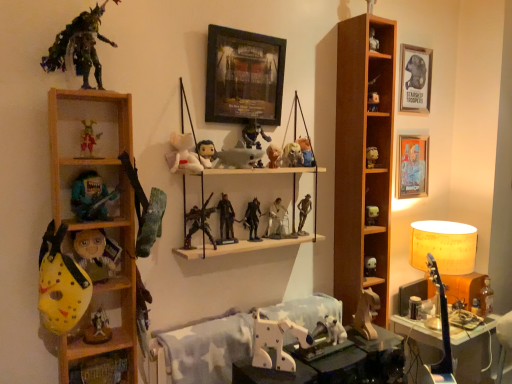
This screenshot has width=512, height=384. Describe the element at coordinates (371, 215) in the screenshot. I see `white matte figurine at center-right, which appears as the sixteenth toy when viewed from the top` at that location.

Where is `metallic silver picture frame at right, the 2th picture frame from the top`? This screenshot has height=384, width=512. metallic silver picture frame at right, the 2th picture frame from the top is located at coordinates (413, 166).

This screenshot has height=384, width=512. What do you see at coordinates (276, 342) in the screenshot?
I see `white matte wooden dog at lower center, which is counted as the second toy, starting from the bottom` at bounding box center [276, 342].

You are a GUI agent. You are given a task and a screenshot of the screen. Output one action in this format:
    pyautogui.click(x=<x>, y=<y>)
    Task: Click on the black matte figure at center, acting as the 15th toy starting from the top
    The image size is (512, 384).
    Given the screenshot: What is the action you would take?
    pyautogui.click(x=252, y=219)

The height and width of the screenshot is (384, 512). What do you see at coordinates (101, 369) in the screenshot?
I see `wooden shelf at lower left, acting as the 2th shelf starting from the back` at bounding box center [101, 369].

What do you see at coordinates (244, 76) in the screenshot? The width and height of the screenshot is (512, 384). I see `wooden picture frame at upper center, marked as the 2th picture frame in a back-to-front arrangement` at bounding box center [244, 76].

Find the location of a particular element. The height and width of the screenshot is (384, 512). wooden picture frame at upper center, marked as the 2th picture frame in a back-to-front arrangement is located at coordinates (244, 76).

Locate an element on the screen. Image resolution: width=512 pixels, height=384 pixels. white matte figurine at center-right, which appears as the sixteenth toy when viewed from the top is located at coordinates (371, 215).

Can you confirm if matte plastic figurine at upper center, which is the 9th toy in top-to-bottom order, is shorter than yellow plush toy at left, the seventh toy when ordered from bottom to top?

Indeed, matte plastic figurine at upper center, which is the 9th toy in top-to-bottom order, has a lesser height compared to yellow plush toy at left, the seventh toy when ordered from bottom to top.

Which object is further away from the camera, matte plastic figurine at upper center, arranged as the 16th toy when ordered from the bottom, or yellow plush toy at left, the seventh toy when ordered from bottom to top?

matte plastic figurine at upper center, arranged as the 16th toy when ordered from the bottom, is further away from the camera.

Which of these two, matte plastic figurine at upper center, arranged as the 16th toy when ordered from the bottom, or yellow plush toy at left, the eighteenth toy viewed from the top, is wider?

yellow plush toy at left, the eighteenth toy viewed from the top, is wider.

Considering the points (276, 165) and (80, 252), which point is in front, point (276, 165) or point (80, 252)?

The point (80, 252) is closer.

Does white matte plush at lower right, acting as the fifth toy starting from the bottom, contain metallic silver figure at center, which is counted as the twelfth toy, starting from the top?

No, metallic silver figure at center, which is counted as the twelfth toy, starting from the top, is not a part of white matte plush at lower right, acting as the fifth toy starting from the bottom.

Considering the relative sizes of white matte plush at lower right, acting as the fifth toy starting from the bottom, and metallic silver figure at center, which is counted as the twelfth toy, starting from the top, in the image provided, is white matte plush at lower right, acting as the fifth toy starting from the bottom, taller than metallic silver figure at center, which is counted as the twelfth toy, starting from the top,?

No, white matte plush at lower right, acting as the fifth toy starting from the bottom, is not taller than metallic silver figure at center, which is counted as the twelfth toy, starting from the top.

Is white matte plush at lower right, the 20th toy positioned from the top, oriented towards metallic silver figure at center, which is counted as the twelfth toy, starting from the top?

No, white matte plush at lower right, the 20th toy positioned from the top, is not aimed at metallic silver figure at center, which is counted as the twelfth toy, starting from the top.

Which of these two, matte plastic action figure at center, the 22th toy from the bottom, or matte plastic figurine at upper center, which is the 9th toy in top-to-bottom order, stands shorter?

Standing shorter between the two is matte plastic figurine at upper center, which is the 9th toy in top-to-bottom order.

Looking at this image, is matte plastic action figure at center, the 22th toy from the bottom, to the right of matte plastic figurine at upper center, arranged as the 16th toy when ordered from the bottom, from the viewer's perspective?

Incorrect, matte plastic action figure at center, the 22th toy from the bottom, is not on the right side of matte plastic figurine at upper center, arranged as the 16th toy when ordered from the bottom.

From a real-world perspective, is matte plastic action figure at center, the 22th toy from the bottom, on matte plastic figurine at upper center, which is the 9th toy in top-to-bottom order?

Yes.

Identify the location of the 2nd toy counting from the left side of the matte plastic figurine at upper center, arranged as the 16th toy when ordered from the bottom. This screenshot has width=512, height=384. (252, 135).

From a real-world perspective, is yellow foam hockey mask at left, the nineteenth toy viewed from the top, above or below matte plastic action figure at center, the 22th toy from the bottom?

yellow foam hockey mask at left, the nineteenth toy viewed from the top, is situated lower than matte plastic action figure at center, the 22th toy from the bottom, in the real world.

Considering the relative sizes of yellow foam hockey mask at left, the sixth toy in the bottom-to-top sequence, and matte plastic action figure at center, placed as the third toy when sorted from top to bottom, in the image provided, is yellow foam hockey mask at left, the sixth toy in the bottom-to-top sequence, taller than matte plastic action figure at center, placed as the third toy when sorted from top to bottom,?

Indeed, yellow foam hockey mask at left, the sixth toy in the bottom-to-top sequence, has a greater height compared to matte plastic action figure at center, placed as the third toy when sorted from top to bottom.

I want to click on toy that is the 16th one when counting upward from the yellow foam hockey mask at left, the nineteenth toy viewed from the top (from the image's perspective), so click(x=252, y=135).

Does yellow foam hockey mask at left, the sixth toy in the bottom-to-top sequence, turn towards matte plastic action figure at center, the 22th toy from the bottom?

No, yellow foam hockey mask at left, the sixth toy in the bottom-to-top sequence, is not oriented towards matte plastic action figure at center, the 22th toy from the bottom.

How far apart are wooden dog at center, the 1th toy ordered from the bottom, and matte black action figure at center, the fourth toy from the bottom?

wooden dog at center, the 1th toy ordered from the bottom, and matte black action figure at center, the fourth toy from the bottom, are 17.22 inches apart.

Which object is wider, wooden dog at center, which is counted as the 24th toy, starting from the top, or matte black action figure at center, the fourth toy from the bottom?

wooden dog at center, which is counted as the 24th toy, starting from the top, is wider.

From the image's perspective, is wooden dog at center, which is counted as the 24th toy, starting from the top, above or below matte black action figure at center, which is the 21th toy in top-to-bottom order?

Based on their image positions, wooden dog at center, which is counted as the 24th toy, starting from the top, is located beneath matte black action figure at center, which is the 21th toy in top-to-bottom order.

Is black matte figure at center, acting as the 15th toy starting from the top, touching white matte figurine at center-right, the ninth toy positioned from the bottom?

No, black matte figure at center, acting as the 15th toy starting from the top, is not beside white matte figurine at center-right, the ninth toy positioned from the bottom.

Find the location of `the 1st toy above the white matte figurine at center-right, which appears as the sixteenth toy when viewed from the top (from the image's perspective)`. the 1st toy above the white matte figurine at center-right, which appears as the sixteenth toy when viewed from the top (from the image's perspective) is located at coordinates (252, 219).

Measure the distance from black matte figure at center, acting as the 15th toy starting from the top, to white matte figurine at center-right, which appears as the sixteenth toy when viewed from the top.

black matte figure at center, acting as the 15th toy starting from the top, and white matte figurine at center-right, which appears as the sixteenth toy when viewed from the top, are 55.65 centimeters apart from each other.

Is black matte figure at center, the 10th toy when ordered from bottom to top, to the right of white matte figurine at center-right, the ninth toy positioned from the bottom, from the viewer's perspective?

Incorrect, black matte figure at center, the 10th toy when ordered from bottom to top, is not on the right side of white matte figurine at center-right, the ninth toy positioned from the bottom.

Between white matte figurine at center-right, which appears as the sixteenth toy when viewed from the top, and white plush toy at center, the tenth toy in the top-to-bottom sequence, which one is positioned behind?

Positioned behind is white matte figurine at center-right, which appears as the sixteenth toy when viewed from the top.

In terms of width, does white matte figurine at center-right, which appears as the sixteenth toy when viewed from the top, look wider or thinner when compared to white plush toy at center, the tenth toy in the top-to-bottom sequence?

Considering their sizes, white matte figurine at center-right, which appears as the sixteenth toy when viewed from the top, looks slimmer than white plush toy at center, the tenth toy in the top-to-bottom sequence.

Is white matte figurine at center-right, which appears as the sixteenth toy when viewed from the top, smaller than white plush toy at center, marked as the 15th toy in a bottom-to-top arrangement?

Indeed, white matte figurine at center-right, which appears as the sixteenth toy when viewed from the top, has a smaller size compared to white plush toy at center, marked as the 15th toy in a bottom-to-top arrangement.

From the image's perspective, would you say white matte figurine at center-right, the ninth toy positioned from the bottom, is shown under white plush toy at center, the tenth toy in the top-to-bottom sequence?

Yes, from the image's perspective, white matte figurine at center-right, the ninth toy positioned from the bottom, is below white plush toy at center, the tenth toy in the top-to-bottom sequence.

This screenshot has height=384, width=512. I want to click on the 9th toy below when counting from the matte plastic figurine at upper center, arranged as the 16th toy when ordered from the bottom (from the image's perspective), so click(95, 253).

You are a GUI agent. You are given a task and a screenshot of the screen. Output one action in this format:
    pyautogui.click(x=<x>, y=<y>)
    Task: Click on the 4th toy behind the metallic silver figure at center, which is the thirteenth toy in bottom-to-top order, counting from the anchor's position
    This screenshot has width=512, height=384.
    Given the screenshot: What is the action you would take?
    pyautogui.click(x=370, y=266)

From the image, which object appears to be farther from matte plastic skull at center, which is counted as the 20th toy, starting from the bottom, wooden shelf at left, marked as the first shelf in a front-to-back arrangement, or orange fabric lampshade at right?

The object further to matte plastic skull at center, which is counted as the 20th toy, starting from the bottom, is orange fabric lampshade at right.

Considering their positions, is wooden picture frame at upper center, marked as the 2th picture frame in a back-to-front arrangement, positioned closer to teal matte guitar at left, which is counted as the 11th toy, starting from the top, than wooden shelf at left, the second shelf when ordered from left to right?

The object closer to teal matte guitar at left, which is counted as the 11th toy, starting from the top, is wooden shelf at left, the second shelf when ordered from left to right.

From the image, which object appears to be nearer to wooden shelf at left, placed as the third shelf when sorted from back to front, yellow plush toy at left, the eighteenth toy viewed from the top, or white matte wooden dog at lower center, acting as the 23th toy starting from the top?

yellow plush toy at left, the eighteenth toy viewed from the top, lies closer to wooden shelf at left, placed as the third shelf when sorted from back to front, than the other object.

Based on their spatial positions, is teal matte guitar at left, which is counted as the 11th toy, starting from the top, or metallic figure at center, the 17th toy in the top-to-bottom sequence, closer to wooden table at lower right, placed as the 2th table when sorted from front to back?

metallic figure at center, the 17th toy in the top-to-bottom sequence, lies closer to wooden table at lower right, placed as the 2th table when sorted from front to back, than the other object.

Based on their spatial positions, is white matte figurine at center-right, which appears as the sixteenth toy when viewed from the top, or matte white figurine at upper right, arranged as the 23th toy when ordered from the bottom, further from white matte wooden dog at lower center, which is counted as the second toy, starting from the bottom?

matte white figurine at upper right, arranged as the 23th toy when ordered from the bottom, is further to white matte wooden dog at lower center, which is counted as the second toy, starting from the bottom.

From the image, which object appears to be farther from white matte plush at lower right, acting as the fifth toy starting from the bottom, matte plastic skull at center, the 5th toy viewed from the top, or green matte plush rabbit at upper left, acting as the eighteenth toy starting from the bottom?

green matte plush rabbit at upper left, acting as the eighteenth toy starting from the bottom, is further to white matte plush at lower right, acting as the fifth toy starting from the bottom.

Which object lies further to the anchor point wooden shelf at center right, the third shelf positioned from the left, wooden shelf at left, marked as the first shelf in a front-to-back arrangement, or yellow foam hockey mask at left, the nineteenth toy viewed from the top?

yellow foam hockey mask at left, the nineteenth toy viewed from the top, lies further to wooden shelf at center right, the third shelf positioned from the left, than the other object.

Looking at the image, which one is located closer to black matte figure at center, the 10th toy when ordered from bottom to top, white plastic walker at center, which ranks as the eleventh toy in bottom-to-top order, or matte plastic action figure at center, the 22th toy from the bottom?

white plastic walker at center, which ranks as the eleventh toy in bottom-to-top order, is closer to black matte figure at center, the 10th toy when ordered from bottom to top.

Image resolution: width=512 pixels, height=384 pixels. I want to click on picture frame between green matte plush rabbit at upper left, acting as the eighteenth toy starting from the bottom, and orange fabric lampshade at right from left to right, so click(244, 76).

Image resolution: width=512 pixels, height=384 pixels. In order to click on shelf located between yellow plush toy at left, the eighteenth toy viewed from the top, and white matte figurine at center-right, the ninth toy positioned from the bottom, in the left-right direction in this screenshot , I will do `click(362, 167)`.

At what (x,y) coordinates should I click in order to perform the action: click on table lamp situated between yellow plush toy at left, the eighteenth toy viewed from the top, and wooden table at lower right, which is counted as the 2th table, starting from the left, from left to right. Please return your answer as a coordinate pair (x, y). Looking at the image, I should click on (443, 272).

Where is `table lamp between wooden picture frame at upper center, acting as the first picture frame starting from the top, and white plastic table at lower center, positioned as the 2th table in right-to-left order, in the up-down direction`? Image resolution: width=512 pixels, height=384 pixels. table lamp between wooden picture frame at upper center, acting as the first picture frame starting from the top, and white plastic table at lower center, positioned as the 2th table in right-to-left order, in the up-down direction is located at coordinates (443, 272).